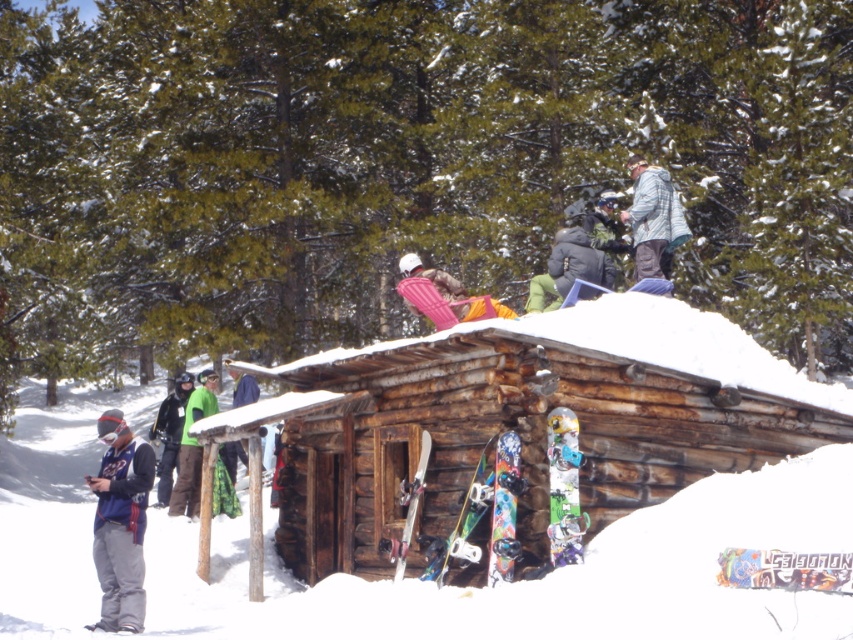
Question: Which object is positioned closest to the green fabric pants at lower left?

Choices:
 (A) rustic wooden cabin at center
 (B) multicolored graphic snowboard at center
 (C) green leafy tree at upper center
 (D) multicolored painted snowboard at center

Answer: (D)

Question: Is light gray jacket at upper right behind multicolored graphic snowboard at center?

Choices:
 (A) no
 (B) yes

Answer: (B)

Question: Is green leafy tree at upper center wider than multicolored glossy snowboard at lower center?

Choices:
 (A) no
 (B) yes

Answer: (B)

Question: Based on their relative distances, which object is nearer to the black matte jacket at left?

Choices:
 (A) light gray jacket at upper right
 (B) green fabric pants at lower left
 (C) gray fleece jacket at left

Answer: (B)

Question: Which of these objects is positioned farthest from the black matte jacket at left?

Choices:
 (A) green fabric jacket at center
 (B) multicolored fiberglass snowboard at center

Answer: (B)

Question: Does light gray jacket at upper right have a greater width compared to black matte jacket at left?

Choices:
 (A) no
 (B) yes

Answer: (A)